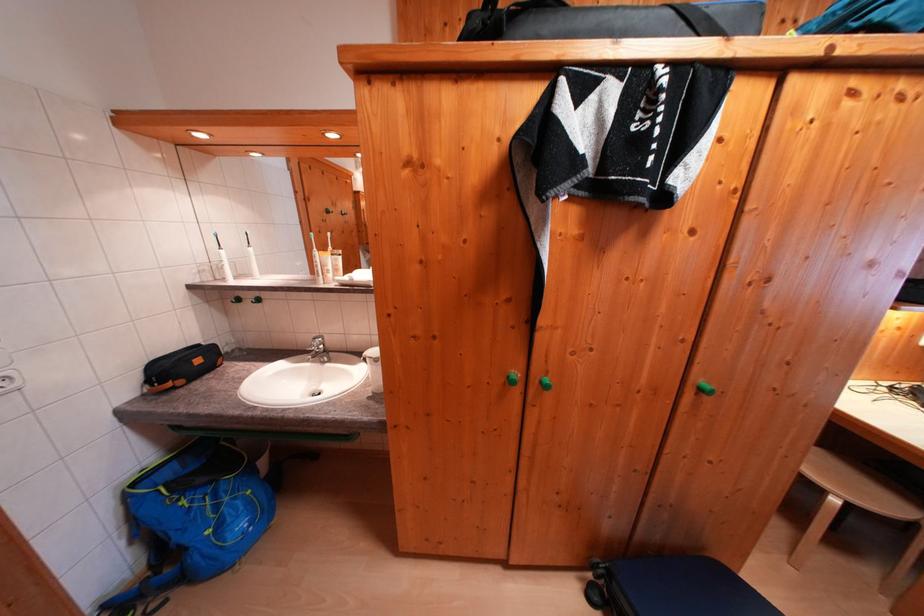
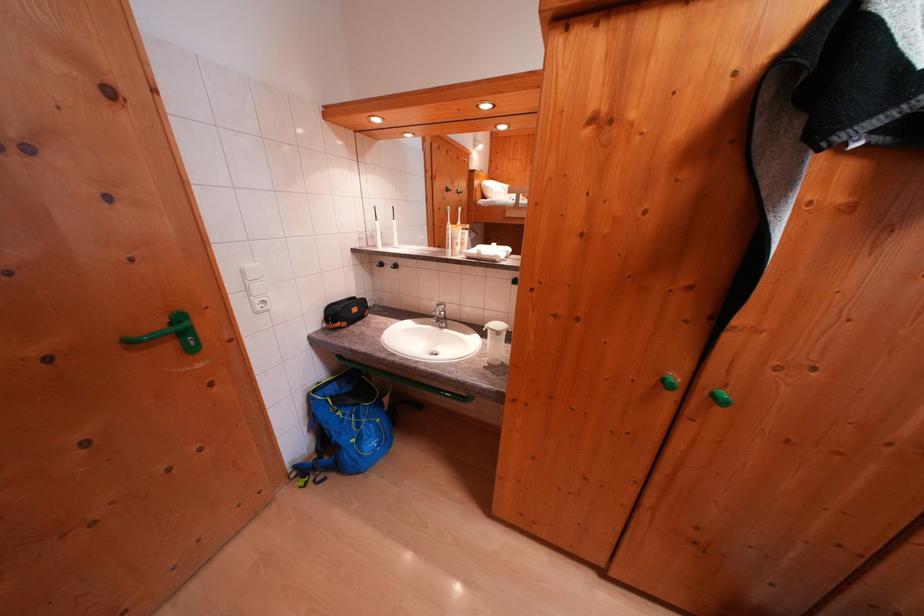
Question: How did the camera likely rotate?

Choices:
 (A) Left
 (B) Right
 (C) Up
 (D) Down

Answer: (A)